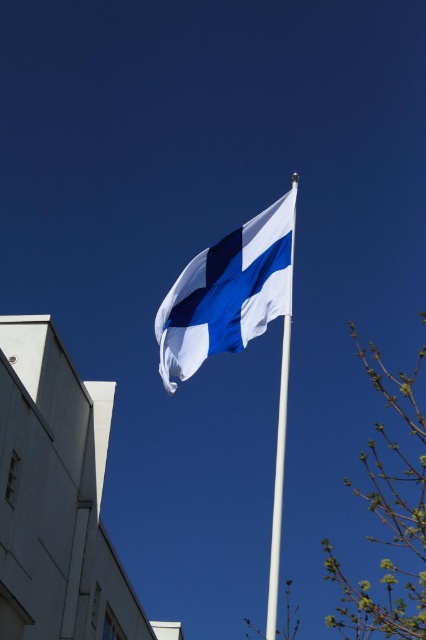
You are standing in front of the Finnish flag and want to take a photo of the point at coordinates point (284, 228). Your camera has a maximum focus range of 50 meters. Will the camera be able to focus on the point?

The point (284, 228) is 46.35 meters away from the camera. Since the maximum focus range is 50 meters, the camera can focus on the point as it is within the range.

You are a photographer trying to capture the Finnish flag and its pole. Given that the white fabric flag at center is smaller than the white metallic pole at center, which one should you focus on to ensure it is clearly visible in your photo?

The white metallic pole at center is larger than the white fabric flag at center, so focusing on the white metallic pole at center would ensure it is clearly visible in the photo.

From the picture: You are an architect designing a new building. You observe the white fabric flag at center and the white metallic pole at center in the image. Which object is closer to the building in the lower left corner?

The white fabric flag at center is positioned over the white metallic pole at center, so the flag is closer to the building in the lower left corner than the pole.